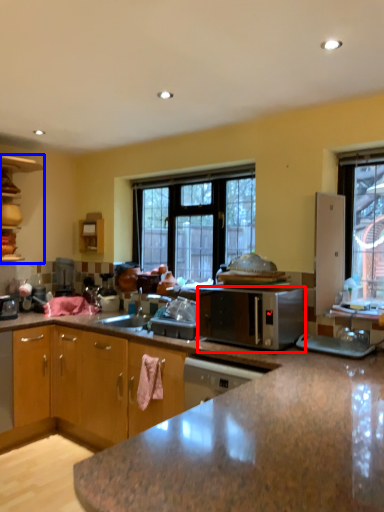
Question: Which object appears farthest to the camera in this image, microwave oven (highlighted by a red box) or cabinetry (highlighted by a blue box)?

Choices:
 (A) microwave oven
 (B) cabinetry

Answer: (B)